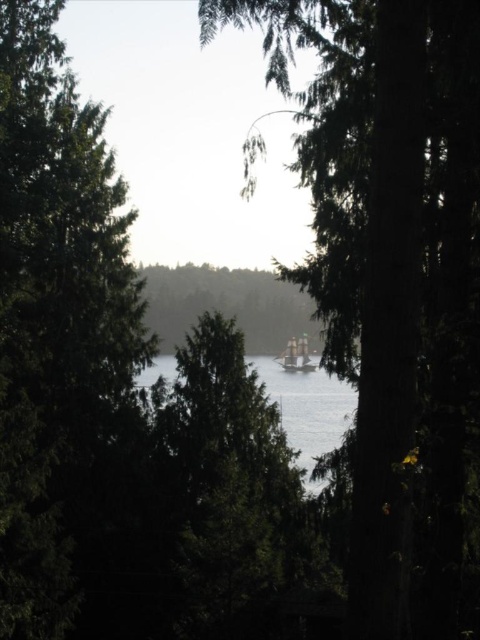
Is point (305, 442) less distant than point (296, 346)?

Yes, it is.

Is transparent water at center taller than wooden ship at center?

Yes, transparent water at center is taller than wooden ship at center.

This screenshot has width=480, height=640. What do you see at coordinates (308, 410) in the screenshot? I see `transparent water at center` at bounding box center [308, 410].

Identify the location of transparent water at center. (308, 410).

Is green textured tree at center to the right of transparent water at center from the viewer's perspective?

Correct, you'll find green textured tree at center to the right of transparent water at center.

Between green textured tree at center and transparent water at center, which one is positioned higher?

Positioned higher is green textured tree at center.

Describe the element at coordinates (394, 284) in the screenshot. I see `green textured tree at center` at that location.

Identify the location of green textured tree at center. Image resolution: width=480 pixels, height=640 pixels. (394, 284).

Who is lower down, green matte tree at center or wooden ship at center?

wooden ship at center is lower down.

Who is taller, green matte tree at center or wooden ship at center?

With more height is green matte tree at center.

Does point (84, 378) come behind point (283, 356)?

No, (84, 378) is in front of (283, 356).

The image size is (480, 640). Find the location of `green matte tree at center`. green matte tree at center is located at coordinates (55, 314).